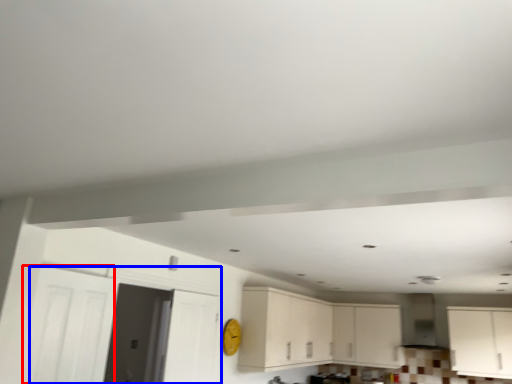
Question: Which of the following is the farthest to the observer, door (highlighted by a red box) or door (highlighted by a blue box)?

Choices:
 (A) door
 (B) door

Answer: (B)